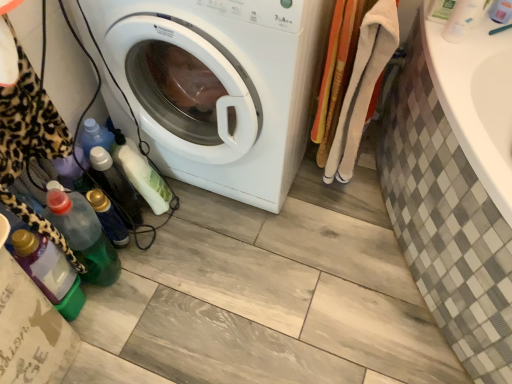
Identify the location of free space to the right of translucent plastic bottle at lower left, the third bottle in the right-to-left sequence. This screenshot has height=384, width=512. (198, 214).